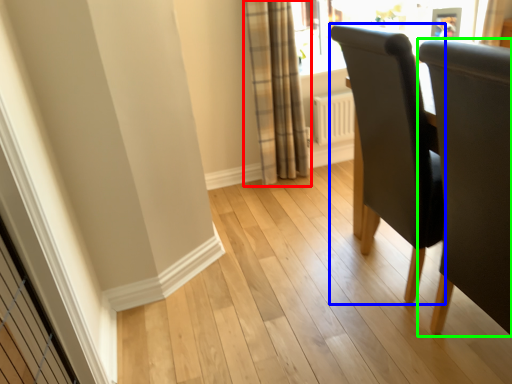
Question: Which object is positioned closest to curtain (highlighted by a red box)? Select from chair (highlighted by a blue box) and chair (highlighted by a green box).

Choices:
 (A) chair
 (B) chair

Answer: (A)